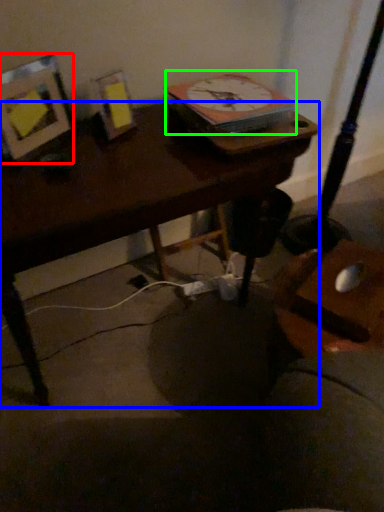
Question: Which object is the closest to the picture frame (highlighted by a red box)? Choose among these: desk (highlighted by a blue box) or clock (highlighted by a green box).

Choices:
 (A) desk
 (B) clock

Answer: (A)